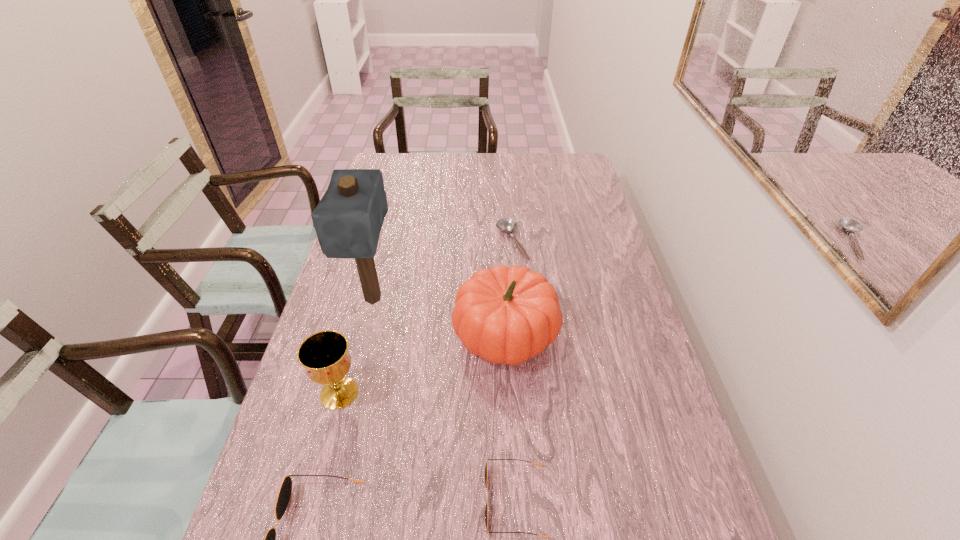
Where is `blank area at the right edge`? blank area at the right edge is located at coordinates point(679,478).

Locate an element on the screen. The width and height of the screenshot is (960, 540). blank region between the chalice and the farthest object is located at coordinates (425, 318).

You are a GUI agent. You are given a task and a screenshot of the screen. Output one action in this format:
    pyautogui.click(x=<x>, y=<y>)
    Task: Click on the free space between the farthest object and the right sunglasses
    Image resolution: width=960 pixels, height=540 pixels.
    Given the screenshot: What is the action you would take?
    pyautogui.click(x=514, y=372)

This screenshot has width=960, height=540. What are the coordinates of `free area in between the farthest object and the chalice` in the screenshot? It's located at (425, 318).

The width and height of the screenshot is (960, 540). Find the location of `unoccupied area between the chalice and the pumpkin`. unoccupied area between the chalice and the pumpkin is located at coordinates (422, 363).

Image resolution: width=960 pixels, height=540 pixels. I want to click on blank region between the chalice and the pumpkin, so click(422, 363).

Identify the location of free spot between the shortest object and the mallet. (443, 271).

Select which object is the fourth closest to the tallest object. Please provide its 2D coordinates. Your answer should be formatted as a tuple, i.e. [(x, y)], where the tuple contains the x and y coordinates of a point satisfying the conditions above.

[(284, 495)]

Where is `object that is the third closest to the mallet`? The width and height of the screenshot is (960, 540). object that is the third closest to the mallet is located at coordinates (508, 225).

Locate an element on the screen. Image resolution: width=960 pixels, height=540 pixels. free space that satisfies the following two spatial constraints: 1. on the back side of the ladle; 2. on the left side of the chalice is located at coordinates (379, 242).